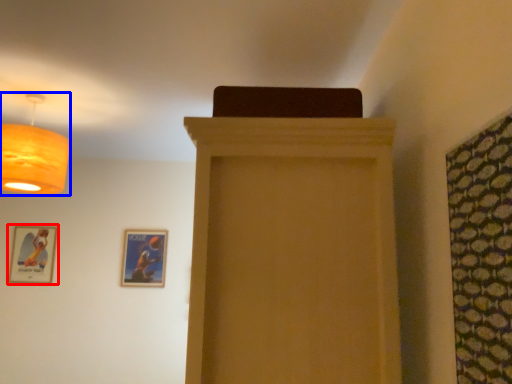
Question: Which object is further to the camera taking this photo, picture frame (highlighted by a red box) or lamp (highlighted by a blue box)?

Choices:
 (A) picture frame
 (B) lamp

Answer: (A)